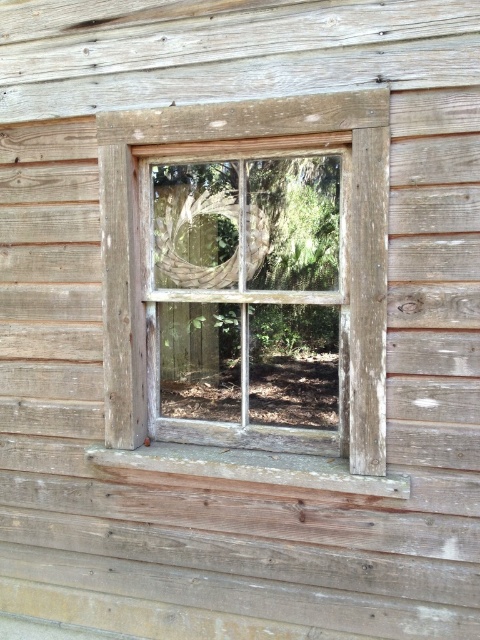
Between point (340, 120) and point (255, 451), which one is positioned behind?

Positioned behind is point (255, 451).

Is weathered wood window at center thinner than weathered wood at bottom?

Correct, weathered wood window at center's width is less than weathered wood at bottom's.

The width and height of the screenshot is (480, 640). In order to click on weathered wood window at center in this screenshot , I will do `click(247, 288)`.